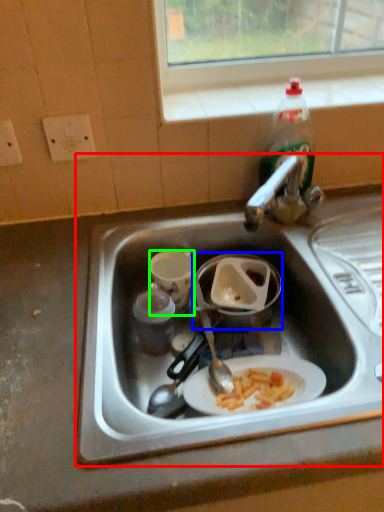
Question: Which object is the closest to the sink (highlighted by a red box)? Choose among these: appliance (highlighted by a blue box) or coffee cup (highlighted by a green box).

Choices:
 (A) appliance
 (B) coffee cup

Answer: (A)